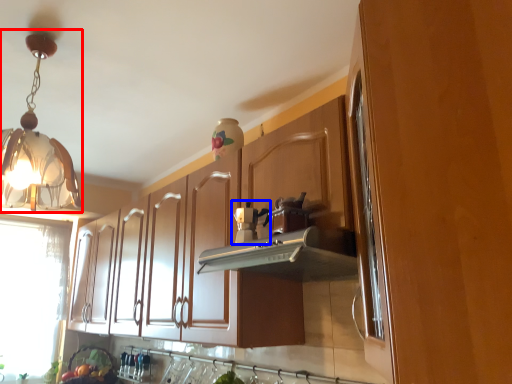
Question: Which point is further to the camera, lamp (highlighted by a red box) or coffee machine (highlighted by a blue box)?

Choices:
 (A) lamp
 (B) coffee machine

Answer: (B)